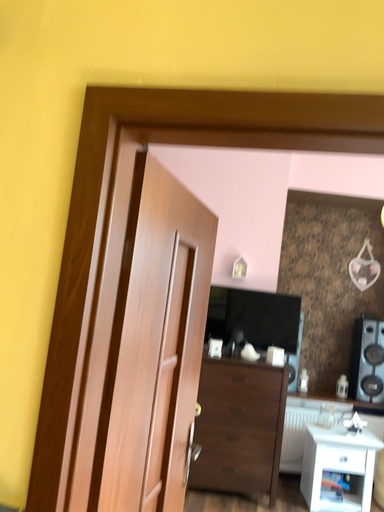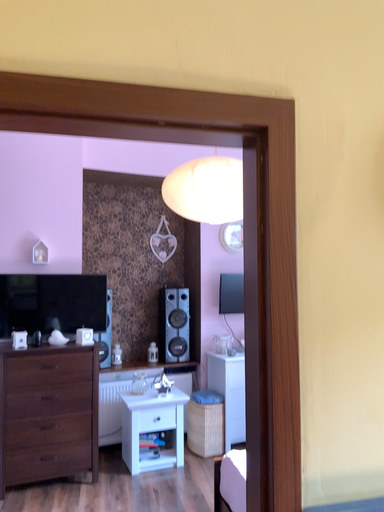
Question: How did the camera likely rotate when shooting the video?

Choices:
 (A) rotated left
 (B) rotated right

Answer: (B)